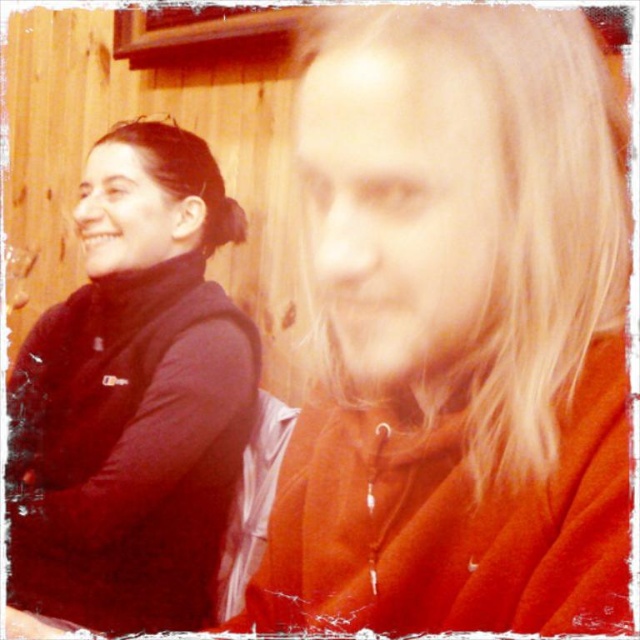
You are trying to locate the orange fleece jacket at center in the image. According to the coordinates provided, where exactly is it positioned?

The orange fleece jacket at center is located at point coordinates of [458,332].

Looking at this image, you are taking a photo with your phone and want to focus on the point at coordinates point (477, 474). Your phone has a minimum focus distance of 12 inches. Can the phone focus on that point?

The point (477, 474) is 16.40 inches from the camera, which is beyond the phone camera minimum focus distance of 12 inches. Therefore, the phone can focus on that point.